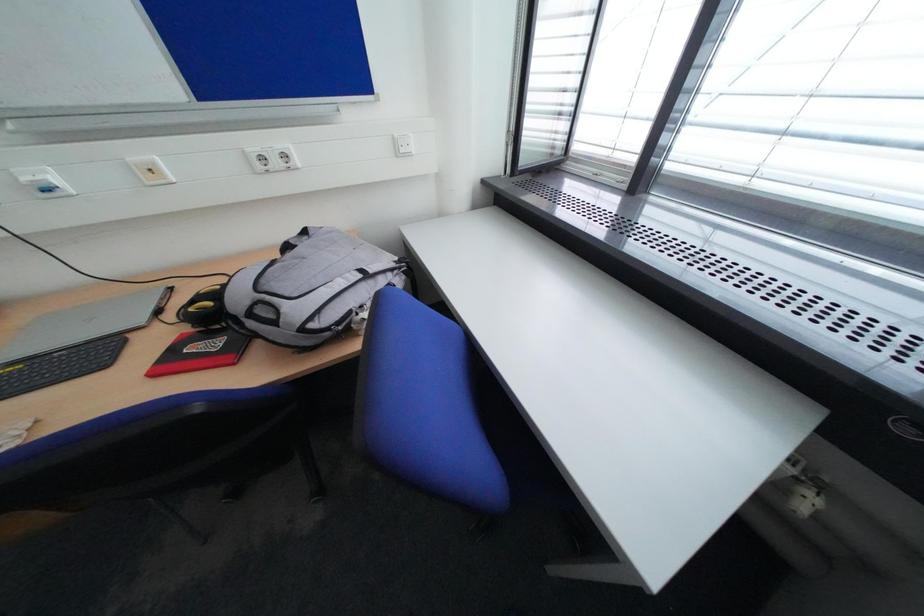
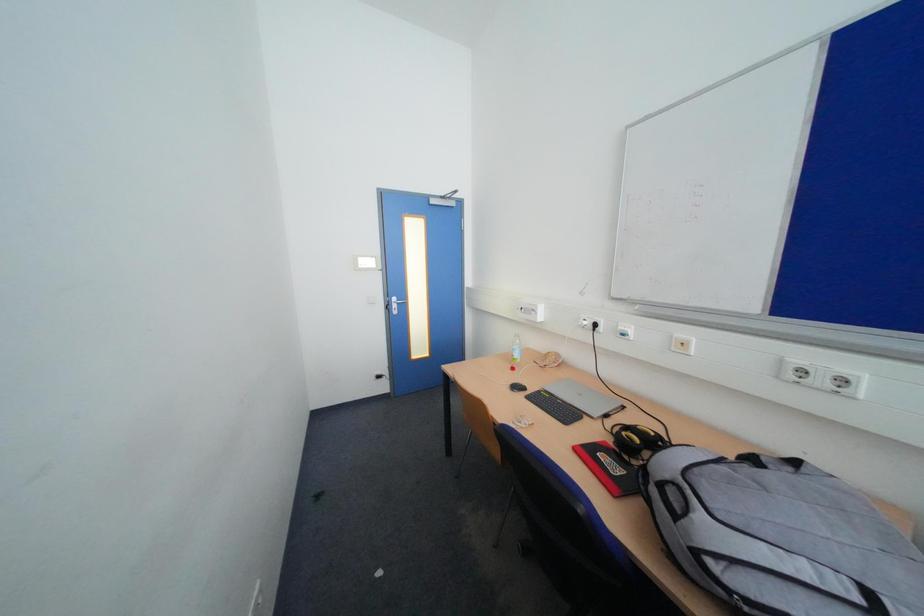
Question: The camera is either moving clockwise (left) or counter-clockwise (right) around the object. The first image is from the beginning of the video and the second image is from the end. Is the camera moving left or right when shooting the video?

Choices:
 (A) Left
 (B) Right

Answer: (B)